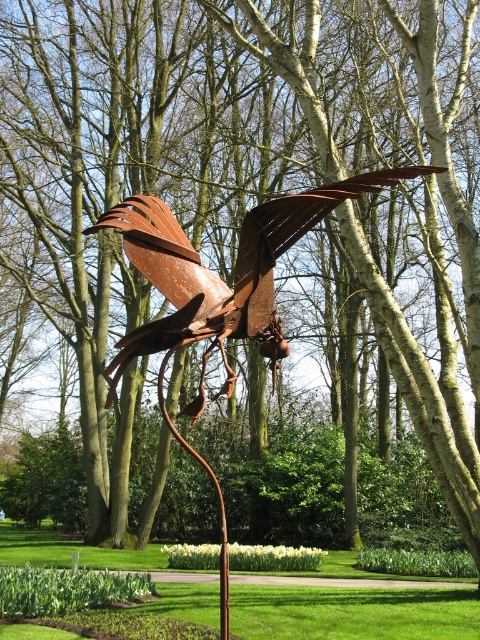
Does rusty metal bird at center have a greater width compared to rusty metal sculpture at center?

No.

Is rusty metal bird at center thinner than rusty metal sculpture at center?

Indeed, rusty metal bird at center has a lesser width compared to rusty metal sculpture at center.

Between point (218, 298) and point (20, 548), which one is positioned in front?

Point (218, 298) is in front.

Identify the location of rusty metal bird at center. 216,275.